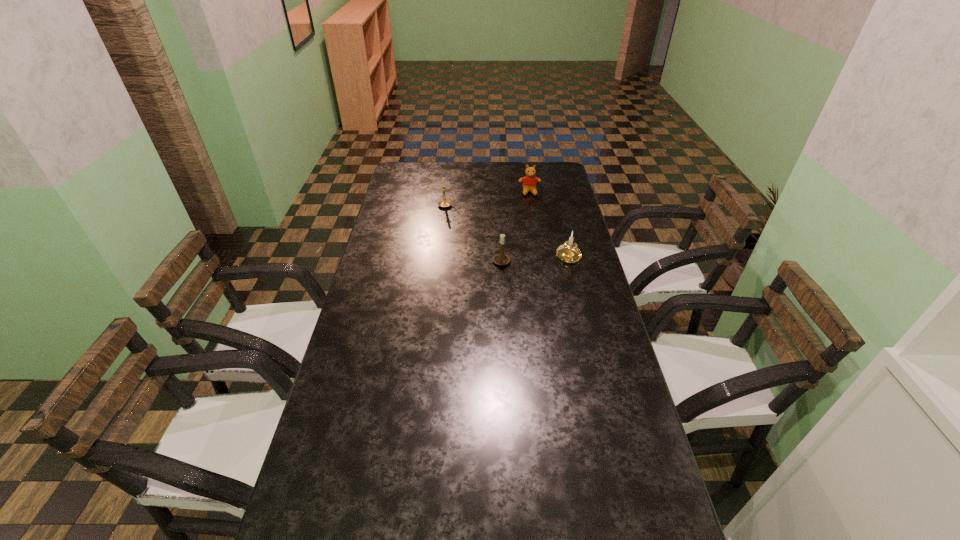
Select which object appears as the third closest to the teddy bear. Please provide its 2D coordinates. Your answer should be formatted as a tuple, i.e. [(x, y)], where the tuple contains the x and y coordinates of a point satisfying the conditions above.

[(500, 259)]

At what (x,y) coordinates should I click in order to perform the action: click on candle holder that stands as the second closest to the third object from left to right. Please return your answer as a coordinate pair (x, y). The width and height of the screenshot is (960, 540). Looking at the image, I should click on (568, 252).

Locate which candle holder is the closest to the teddy bear. Please provide its 2D coordinates. Your answer should be formatted as a tuple, i.e. [(x, y)], where the tuple contains the x and y coordinates of a point satisfying the conditions above.

[(444, 203)]

Image resolution: width=960 pixels, height=540 pixels. In order to click on vacant point that satisfies the following two spatial constraints: 1. on the front-facing side of the third object from left to right; 2. on the handle side of the leftmost object in this screenshot , I will do `click(532, 205)`.

The height and width of the screenshot is (540, 960). What are the coordinates of `vacant space that satisfies the following two spatial constraints: 1. on the front-facing side of the farthest object; 2. on the handle side of the leftmost candle holder` in the screenshot? It's located at (532, 205).

I want to click on vacant point that satisfies the following two spatial constraints: 1. on the front-facing side of the third object from left to right; 2. on the handle side of the farthest candle holder, so click(532, 205).